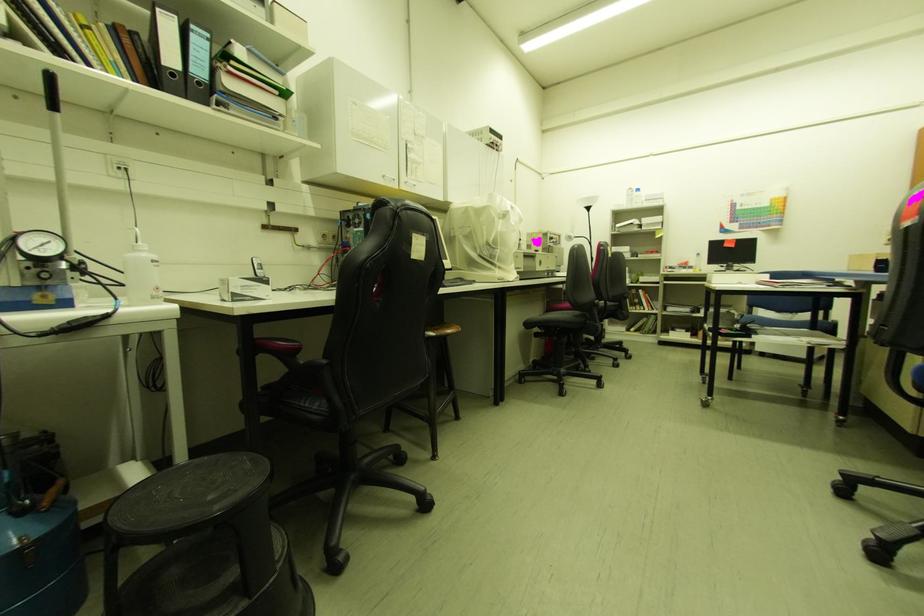
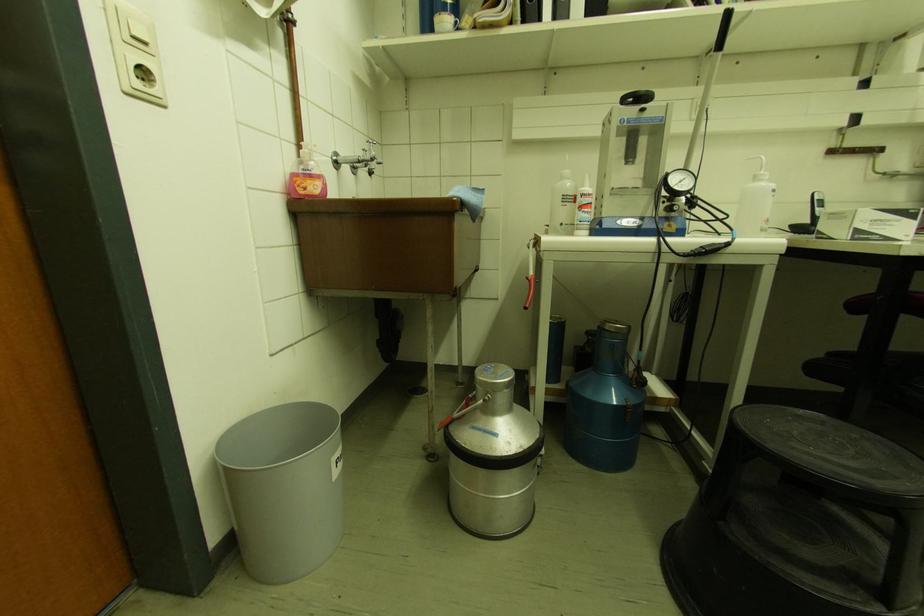
Where in the second image is the point corresponding to [139,251] from the first image?

(759, 180)